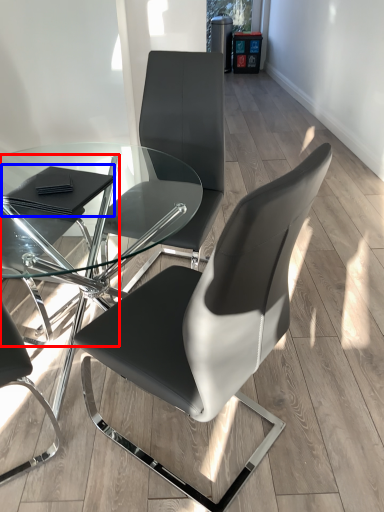
Question: Which object is further to the camera taking this photo, chair (highlighted by a red box) or pad (highlighted by a blue box)?

Choices:
 (A) chair
 (B) pad

Answer: (B)